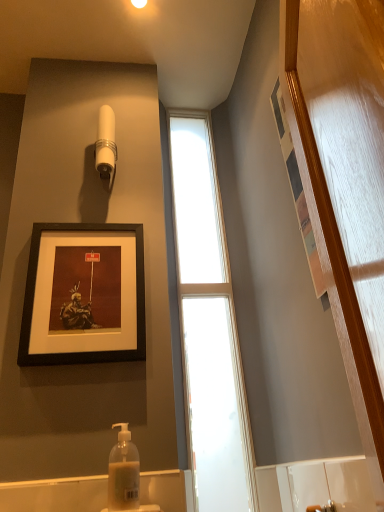
Question: Is matte black frame at upper center to the right of translucent plastic soap dispenser at lower center from the viewer's perspective?

Choices:
 (A) yes
 (B) no

Answer: (B)

Question: Is matte black frame at upper center next to translucent plastic soap dispenser at lower center and touching it?

Choices:
 (A) no
 (B) yes

Answer: (A)

Question: Is there a large distance between matte black frame at upper center and translucent plastic soap dispenser at lower center?

Choices:
 (A) yes
 (B) no

Answer: (B)

Question: Is translucent plastic soap dispenser at lower center at the back of matte black frame at upper center?

Choices:
 (A) no
 (B) yes

Answer: (A)

Question: Is matte black frame at upper center bigger than translucent plastic soap dispenser at lower center?

Choices:
 (A) yes
 (B) no

Answer: (A)

Question: Considering the positions of clear glass window at center and white plastic shower head at upper center in the image, is clear glass window at center bigger or smaller than white plastic shower head at upper center?

Choices:
 (A) small
 (B) big

Answer: (B)

Question: Is clear glass window at center spatially inside white plastic shower head at upper center, or outside of it?

Choices:
 (A) outside
 (B) inside

Answer: (A)

Question: From their relative heights in the image, would you say clear glass window at center is taller or shorter than white plastic shower head at upper center?

Choices:
 (A) short
 (B) tall

Answer: (B)

Question: Considering the relative positions of clear glass window at center and white plastic shower head at upper center in the image provided, is clear glass window at center to the left or to the right of white plastic shower head at upper center?

Choices:
 (A) left
 (B) right

Answer: (B)

Question: From the image's perspective, is clear glass window at center located above or below translucent plastic soap dispenser at lower center?

Choices:
 (A) above
 (B) below

Answer: (A)

Question: Relative to translucent plastic soap dispenser at lower center, is clear glass window at center in front or behind?

Choices:
 (A) behind
 (B) front

Answer: (A)

Question: Considering the positions of clear glass window at center and translucent plastic soap dispenser at lower center in the image, is clear glass window at center bigger or smaller than translucent plastic soap dispenser at lower center?

Choices:
 (A) big
 (B) small

Answer: (A)

Question: From their relative heights in the image, would you say clear glass window at center is taller or shorter than translucent plastic soap dispenser at lower center?

Choices:
 (A) short
 (B) tall

Answer: (B)

Question: Is white plastic shower head at upper center spatially inside clear glass window at center, or outside of it?

Choices:
 (A) outside
 (B) inside

Answer: (A)

Question: In the image, is white plastic shower head at upper center positioned in front of or behind clear glass window at center?

Choices:
 (A) front
 (B) behind

Answer: (B)